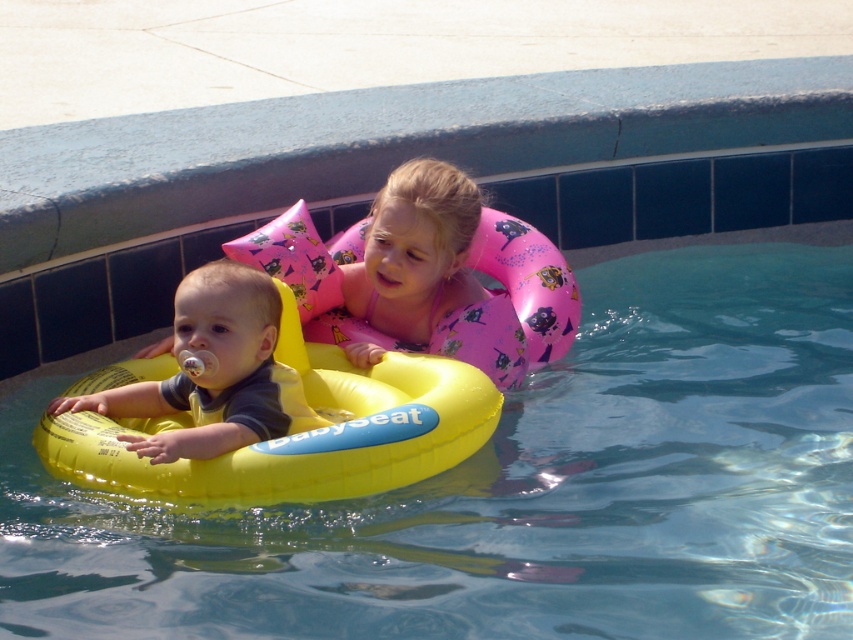
Locate an element on the screen. This screenshot has height=640, width=853. pink rubber ring at center is located at coordinates (426, 280).